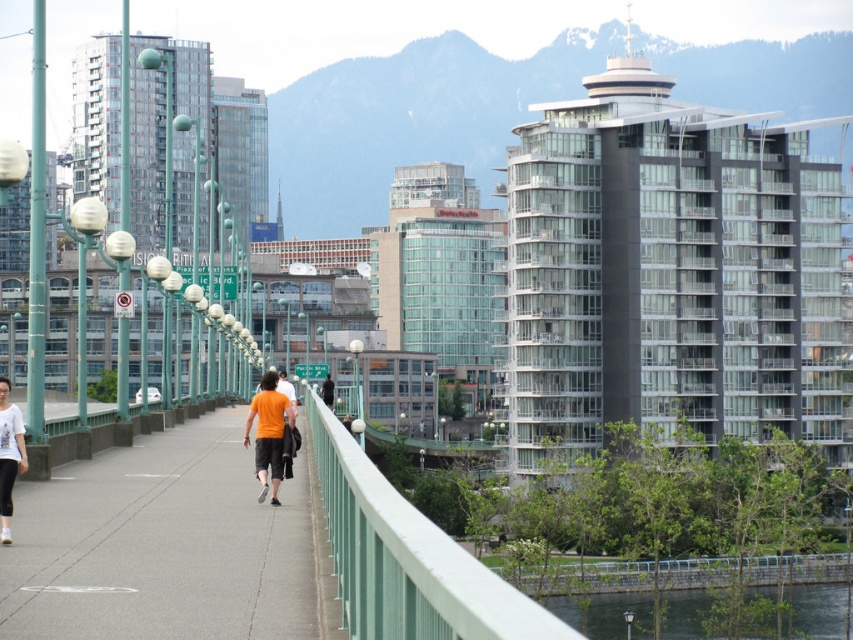
Is green painted metal railing at center bigger than white matte shirt at left?

Yes.

Can you confirm if green painted metal railing at center is positioned to the right of white matte shirt at left?

Indeed, green painted metal railing at center is positioned on the right side of white matte shirt at left.

At what (x,y) coordinates should I click in order to perform the action: click on green painted metal railing at center. Please return your answer as a coordinate pair (x, y). Looking at the image, I should click on tap(407, 557).

Who is shorter, concrete sidewalk at center or white matte shirt at left?

concrete sidewalk at center

Which is behind, point (254, 532) or point (7, 426)?

The point (254, 532) is more distant.

At what (x,y) coordinates should I click in order to perform the action: click on concrete sidewalk at center. Please return your answer as a coordinate pair (x, y). This screenshot has width=853, height=640. Looking at the image, I should click on (160, 545).

Is green painted metal railing at center bigger than green stone wall at lower right?

Incorrect, green painted metal railing at center is not larger than green stone wall at lower right.

Can you confirm if green painted metal railing at center is shorter than green stone wall at lower right?

Indeed, green painted metal railing at center has a lesser height compared to green stone wall at lower right.

Who is more distant from viewer, (422,632) or (641,624)?

Point (641,624)

Find the location of `green painted metal railing at center`. green painted metal railing at center is located at coordinates (407, 557).